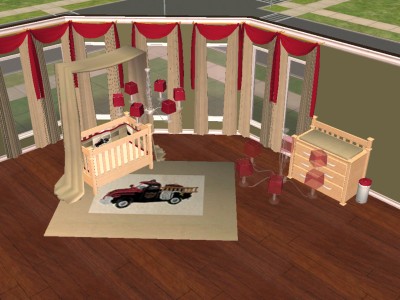
I want to click on diaper genie, so point(360,193).